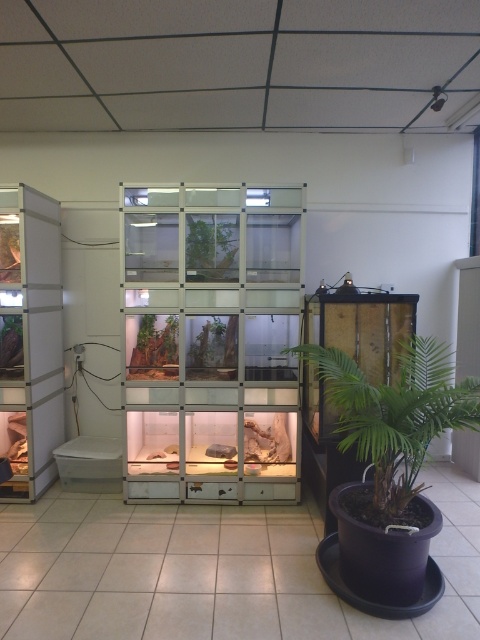
Between green leafy plant at lower right and green matte plant at center, which one appears on the right side from the viewer's perspective?

From the viewer's perspective, green leafy plant at lower right appears more on the right side.

Who is more forward, (x=468, y=413) or (x=190, y=253)?

Point (x=468, y=413) is more forward.

Locate an element on the screen. This screenshot has width=480, height=640. green leafy plant at lower right is located at coordinates (395, 412).